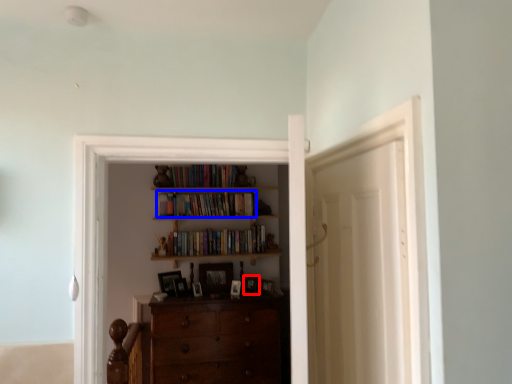
Question: Which object is closer to the camera taking this photo, picture frame (highlighted by a red box) or book (highlighted by a blue box)?

Choices:
 (A) picture frame
 (B) book

Answer: (A)